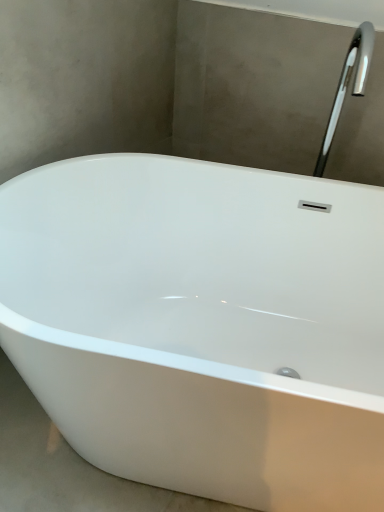
Question: Is white glossy bathtub at center looking in the opposite direction of polished chrome tap at upper right?

Choices:
 (A) yes
 (B) no

Answer: (B)

Question: From a real-world perspective, is white glossy bathtub at center located higher than polished chrome tap at upper right?

Choices:
 (A) no
 (B) yes

Answer: (A)

Question: Could you tell me if white glossy bathtub at center is turned towards polished chrome tap at upper right?

Choices:
 (A) yes
 (B) no

Answer: (B)

Question: Can you confirm if white glossy bathtub at center is thinner than polished chrome tap at upper right?

Choices:
 (A) no
 (B) yes

Answer: (A)

Question: Considering the relative sizes of white glossy bathtub at center and polished chrome tap at upper right in the image provided, is white glossy bathtub at center shorter than polished chrome tap at upper right?

Choices:
 (A) yes
 (B) no

Answer: (B)

Question: Is white glossy bathtub at center positioned behind polished chrome tap at upper right?

Choices:
 (A) no
 (B) yes

Answer: (A)

Question: Does polished chrome tap at upper right come behind white glossy bathtub at center?

Choices:
 (A) yes
 (B) no

Answer: (A)

Question: Is polished chrome tap at upper right oriented towards white glossy bathtub at center?

Choices:
 (A) yes
 (B) no

Answer: (B)

Question: Is polished chrome tap at upper right to the right of white glossy bathtub at center from the viewer's perspective?

Choices:
 (A) no
 (B) yes

Answer: (B)

Question: From a real-world perspective, is polished chrome tap at upper right positioned over white glossy bathtub at center based on gravity?

Choices:
 (A) yes
 (B) no

Answer: (A)

Question: Is polished chrome tap at upper right turned away from white glossy bathtub at center?

Choices:
 (A) no
 (B) yes

Answer: (A)

Question: Is polished chrome tap at upper right not inside white glossy bathtub at center?

Choices:
 (A) no
 (B) yes

Answer: (B)

Question: Is polished chrome tap at upper right taller or shorter than white glossy bathtub at center?

Choices:
 (A) short
 (B) tall

Answer: (A)